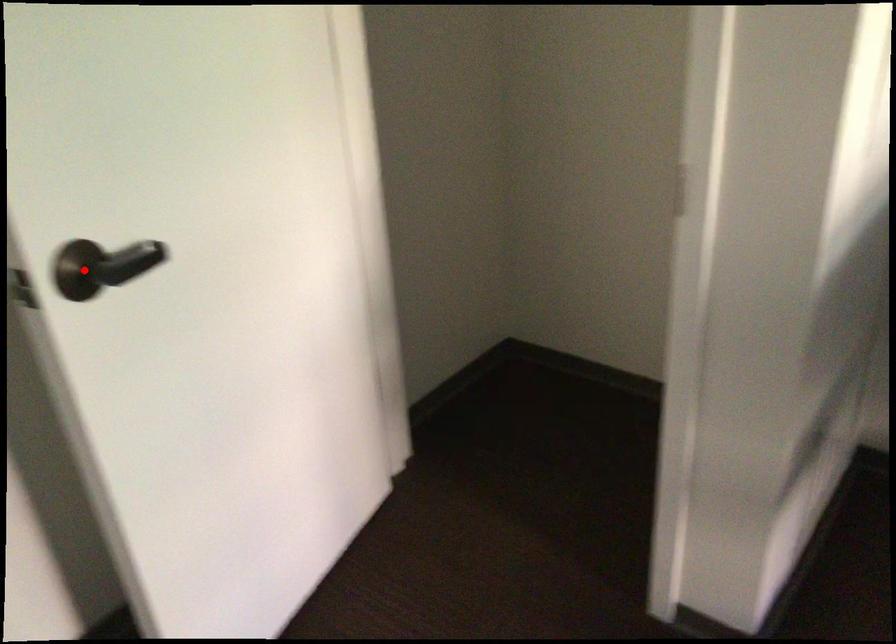
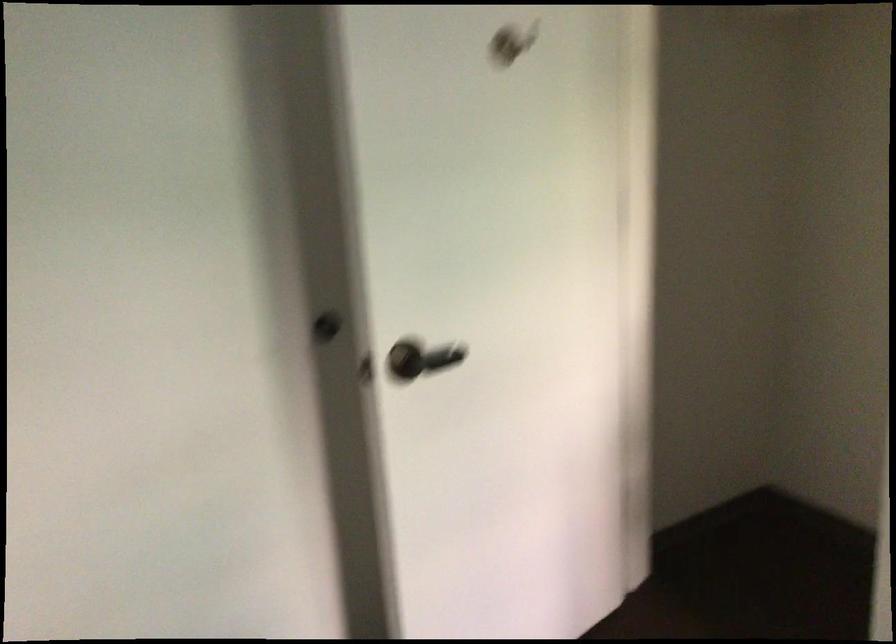
Question: I am providing you with two images of the same scene from different viewpoints. Given a red point in image1, look at the same physical point in image2. Is it:

Choices:
 (A) Closer to the viewpoint
 (B) Farther from the viewpoint

Answer: (B)